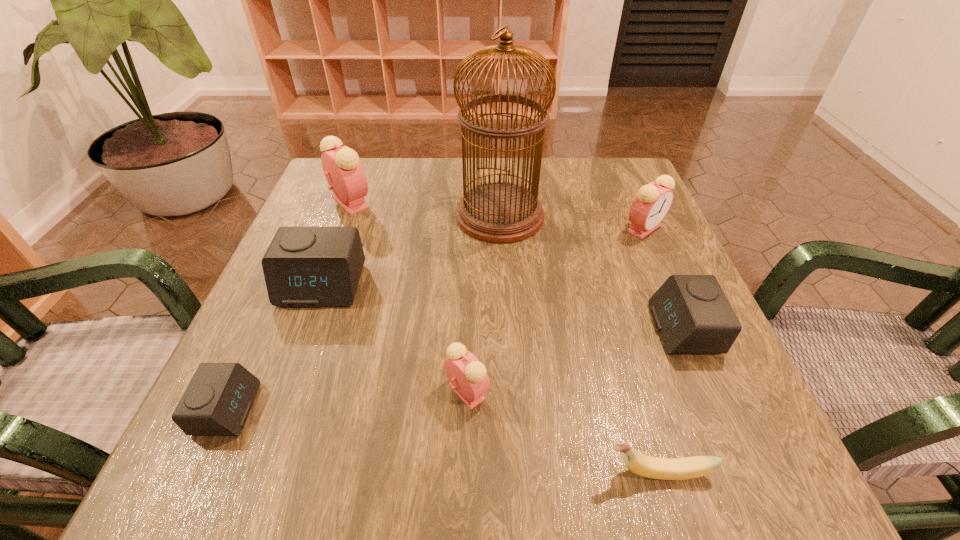
Where is `the nearest object`? Image resolution: width=960 pixels, height=540 pixels. the nearest object is located at coordinates (646, 466).

Locate an element on the screen. The width and height of the screenshot is (960, 540). the smallest black alarm clock is located at coordinates (217, 401).

The width and height of the screenshot is (960, 540). In order to click on the nearest black alarm clock in this screenshot , I will do `click(217, 401)`.

Where is `vacant region located on the front-facing side of the birdcage`? This screenshot has width=960, height=540. vacant region located on the front-facing side of the birdcage is located at coordinates (327, 215).

Where is `free space located 0.270m on the front-facing side of the birdcage`? This screenshot has height=540, width=960. free space located 0.270m on the front-facing side of the birdcage is located at coordinates 336,215.

The image size is (960, 540). What are the coordinates of `free space located on the front-facing side of the birdcage` in the screenshot? It's located at (424, 215).

I want to click on free space located 0.350m on the face of the leftmost pink alarm clock, so click(523, 202).

This screenshot has height=540, width=960. I want to click on blank space located on the face of the fifth shortest alarm clock, so click(x=715, y=392).

Image resolution: width=960 pixels, height=540 pixels. I want to click on vacant region located on the front-facing side of the biggest black alarm clock, so click(248, 486).

You are a GUI agent. You are given a task and a screenshot of the screen. Output one action in this format:
    pyautogui.click(x=<x>, y=<y>)
    Task: Click on the vacant space located 0.190m on the face of the third alarm clock from right to left
    The width and height of the screenshot is (960, 540).
    Given the screenshot: What is the action you would take?
    pyautogui.click(x=613, y=392)